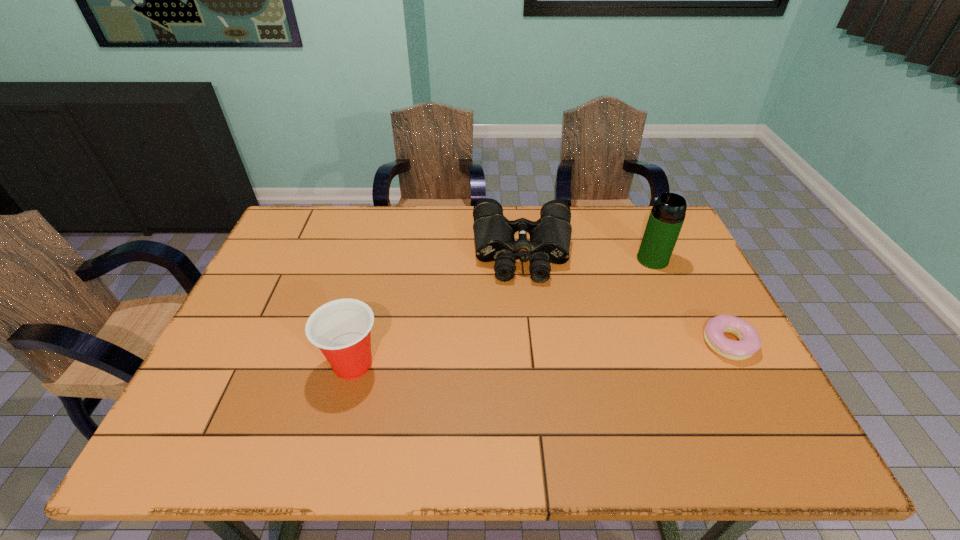
The image size is (960, 540). In order to click on vacant space located through the eyepieces of the second object from left to right in this screenshot , I will do `click(530, 372)`.

You are a GUI agent. You are given a task and a screenshot of the screen. Output one action in this format:
    pyautogui.click(x=<x>, y=<y>)
    Task: Click on the free space located from the spout of the tallest object
    This screenshot has height=540, width=960.
    Given the screenshot: What is the action you would take?
    pyautogui.click(x=578, y=307)

The image size is (960, 540). Identify the location of free point located from the spout of the tallest object. (608, 288).

Where is `free region located 0.130m from the spout of the tallest object`? This screenshot has width=960, height=540. free region located 0.130m from the spout of the tallest object is located at coordinates (614, 284).

The width and height of the screenshot is (960, 540). What are the coordinates of `binoculars present at the far edge` in the screenshot? It's located at click(550, 236).

This screenshot has height=540, width=960. In order to click on thermos bottle at the far edge in this screenshot , I will do `click(667, 215)`.

Where is `object located in the near edge section of the desktop`? Image resolution: width=960 pixels, height=540 pixels. object located in the near edge section of the desktop is located at coordinates (341, 329).

In order to click on doughnut that is positioned at the right edge in this screenshot , I will do `click(749, 342)`.

The width and height of the screenshot is (960, 540). I want to click on thermos bottle present at the right edge, so click(x=667, y=215).

Where is `object located in the far right corner section of the desktop`? object located in the far right corner section of the desktop is located at coordinates (667, 215).